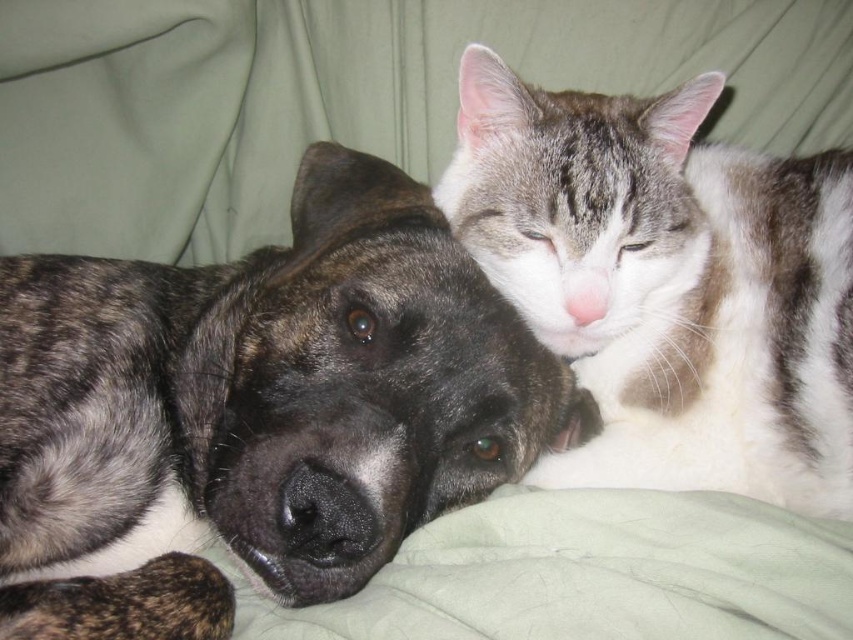
Based on the scene description, which animal is taller between the brindle fur dog at center and the gray and white fur cat at upper right?

The brindle fur dog at center is taller than the gray and white fur cat at upper right according to the description.

You are a photographer standing at the center of the room. You want to take a photo of the brindle fur dog at center. According to the coordinates given, where should you aim your camera to capture the dog perfectly in the frame?

The brindle fur dog at center is located at coordinates point (256, 412), so you should aim your camera at that point to capture the dog perfectly in the frame.

You are a pet owner who wants to place a small toy between the brindle fur dog at center and the gray and white fur cat at upper right. Based on their positions, where should you place the toy so it is equidistant from both animals?

The brindle fur dog at center is below the gray and white fur cat at upper right, so placing the toy midway between their positions would ensure it is equidistant from both animals.